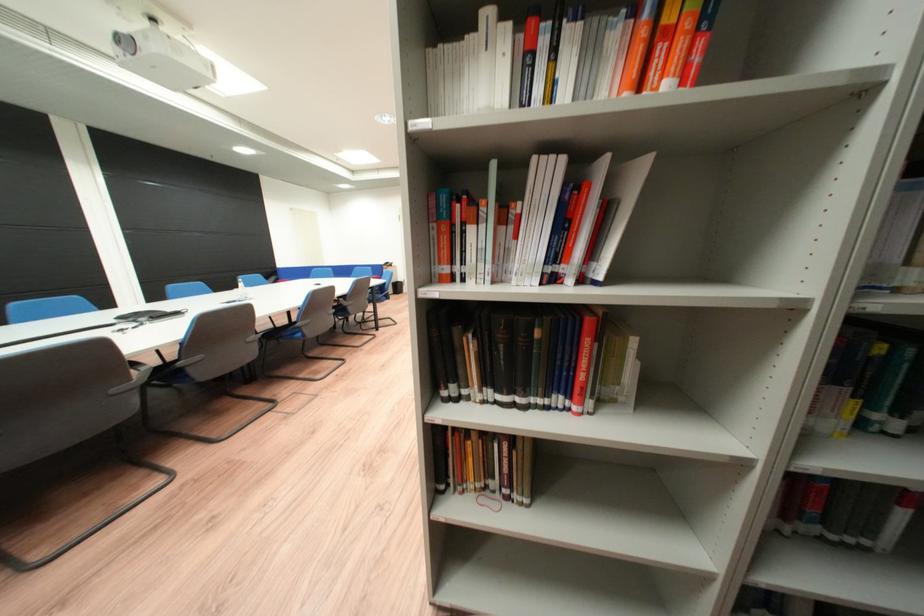
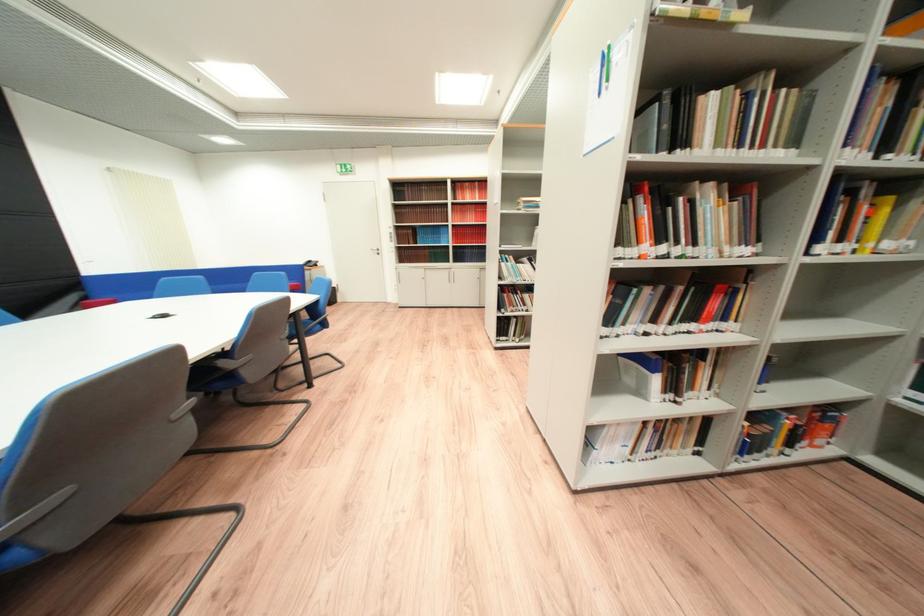
In a continuous first-person perspective shot, in which direction is the camera moving?

The cameraman moved toward left, forward.